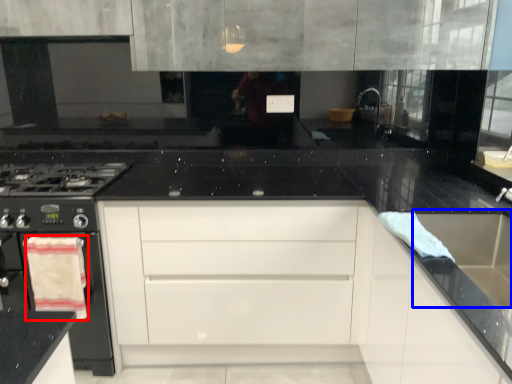
Question: Which object appears farthest to the camera in this image, material (highlighted by a red box) or sink (highlighted by a blue box)?

Choices:
 (A) material
 (B) sink

Answer: (A)